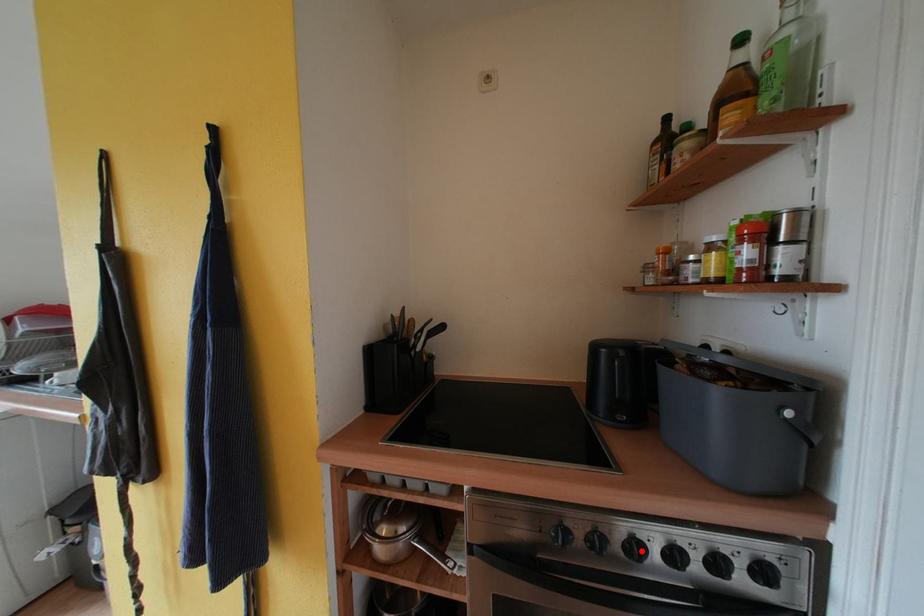
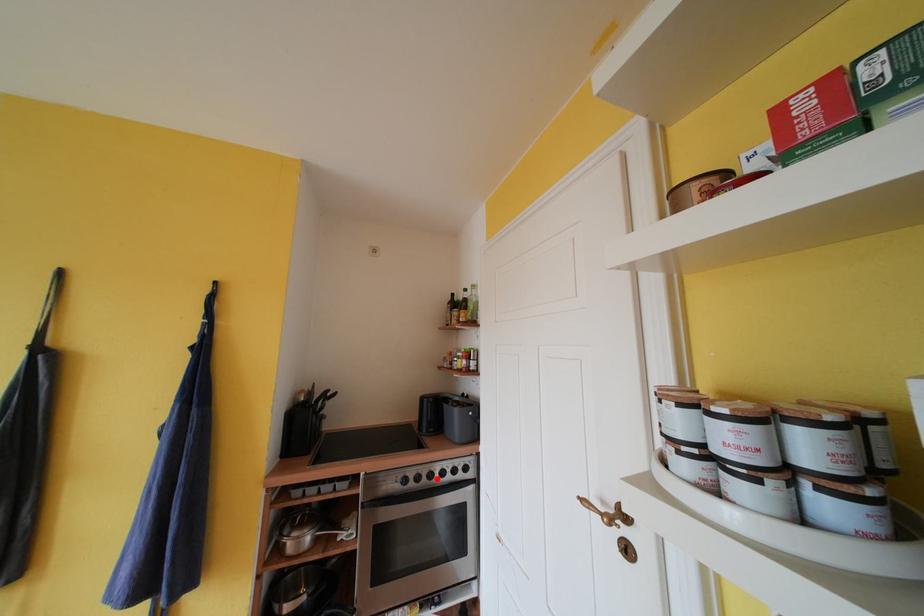
I am providing you with two images of the same scene from different viewpoints. A red point is marked on the first image and another point is marked on the second image. Does the point marked in image1 correspond to the same location as the one in image2?

Yes